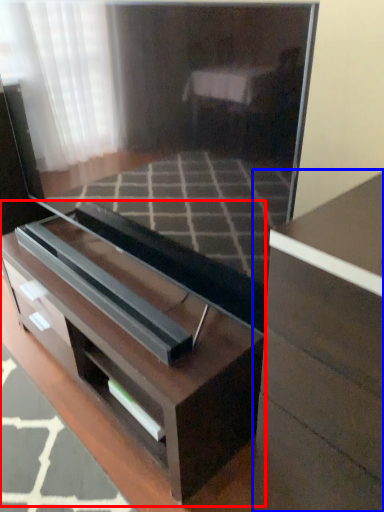
Question: Which of the following is the closest to the observer, chest of drawers (highlighted by a red box) or chest of drawers (highlighted by a blue box)?

Choices:
 (A) chest of drawers
 (B) chest of drawers

Answer: (B)